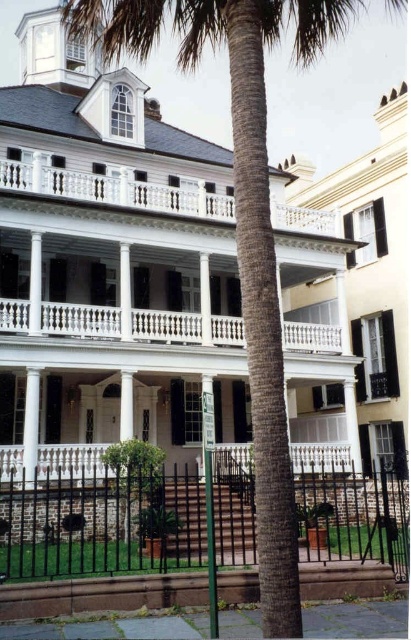
Question: Which point appears farthest from the camera in this image?

Choices:
 (A) (320, 324)
 (B) (320, 515)
 (C) (18, 188)
 (D) (32, 449)

Answer: (A)

Question: Does white wood porch at upper center have a smaller size compared to white glossy column at center?

Choices:
 (A) yes
 (B) no

Answer: (B)

Question: Does black wrought iron fence at lower center have a smaller size compared to white wood porch at upper center?

Choices:
 (A) yes
 (B) no

Answer: (B)

Question: Can you confirm if black wrought iron fence at lower center is positioned to the left of white balustrade at center?

Choices:
 (A) yes
 (B) no

Answer: (B)

Question: Which object is positioned farthest from the white balustrade at center?

Choices:
 (A) white glossy column at center
 (B) white wood porch at upper center
 (C) black wrought iron fence at lower center

Answer: (C)

Question: Which of the following is the closest to the observer?

Choices:
 (A) (350, 492)
 (B) (293, 211)
 (C) (27, 401)
 (D) (290, 348)

Answer: (C)